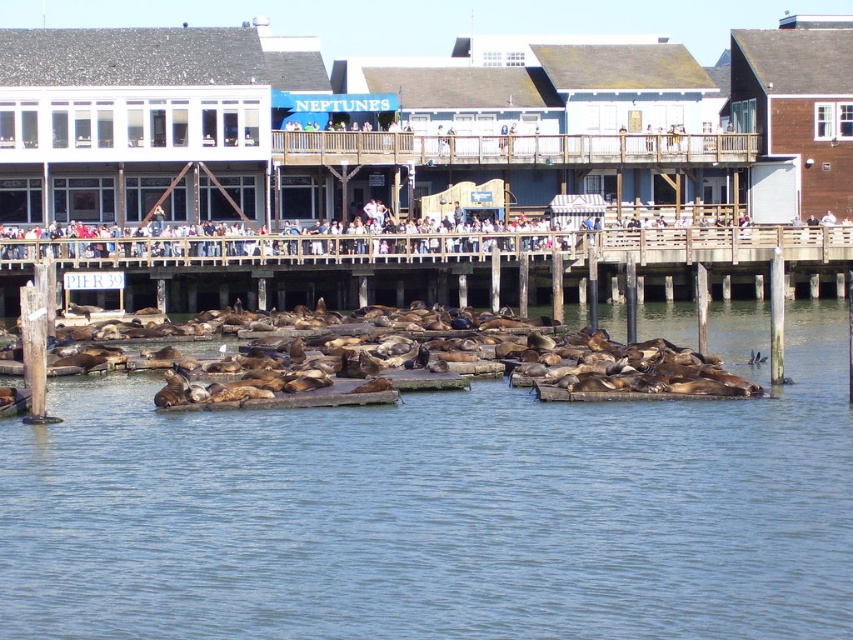
You are standing at the waterfront and want to reach the brown wooden dock at center to feed the sea lions. If your walking speed is 1.5 meters per second, how many seconds will it take you to reach the dock?

The brown wooden dock at center is 98.20 meters away. At a speed of 1.5 meters per second, it will take approximately 65.47 seconds to reach the dock.

You are standing on the wooden pier at Pier 39 and see the clear blue water at center and the brown fur seal at lower center. Which object is closer to the ground level?

The brown fur seal at lower center is closer to the ground level since it is above the clear blue water at center, which is located below it.

You are a photographer standing at the wooden pier at Pier 39. You want to capture a photo of the clear blue water at center and the brown fur seal at lower center in the same frame. Based on their positions, will the water appear taller than the seal in the photo?

The clear blue water at center is taller than the brown fur seal at lower center, so yes, the water will appear taller than the seal in the photo.